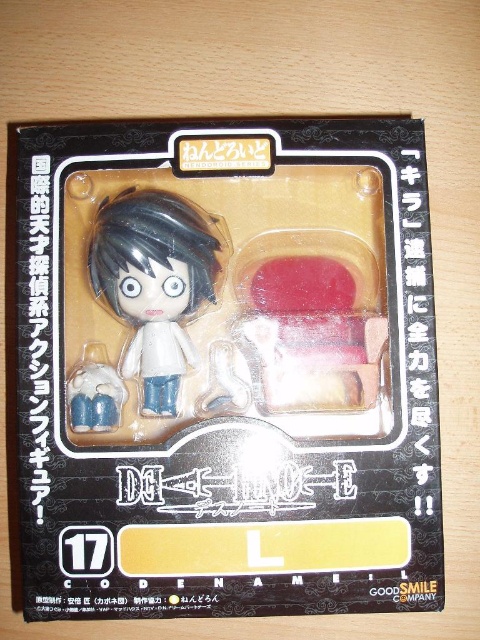
Question: Does matte white doll at center appear under matte white figure at lower left?

Choices:
 (A) no
 (B) yes

Answer: (A)

Question: Which point appears closest to the camera in this image?

Choices:
 (A) (88, 419)
 (B) (29, 132)

Answer: (B)

Question: Does matte black action figure at center have a smaller size compared to matte white figure at lower left?

Choices:
 (A) no
 (B) yes

Answer: (A)

Question: Among these objects, which one is nearest to the camera?

Choices:
 (A) matte white doll at center
 (B) matte black action figure at center

Answer: (B)

Question: Among these points, which one is farthest from the camera?

Choices:
 (A) (368, 464)
 (B) (112, 390)
 (C) (202, 225)

Answer: (C)

Question: Is matte white doll at center to the left of matte white figure at lower left from the viewer's perspective?

Choices:
 (A) yes
 (B) no

Answer: (B)